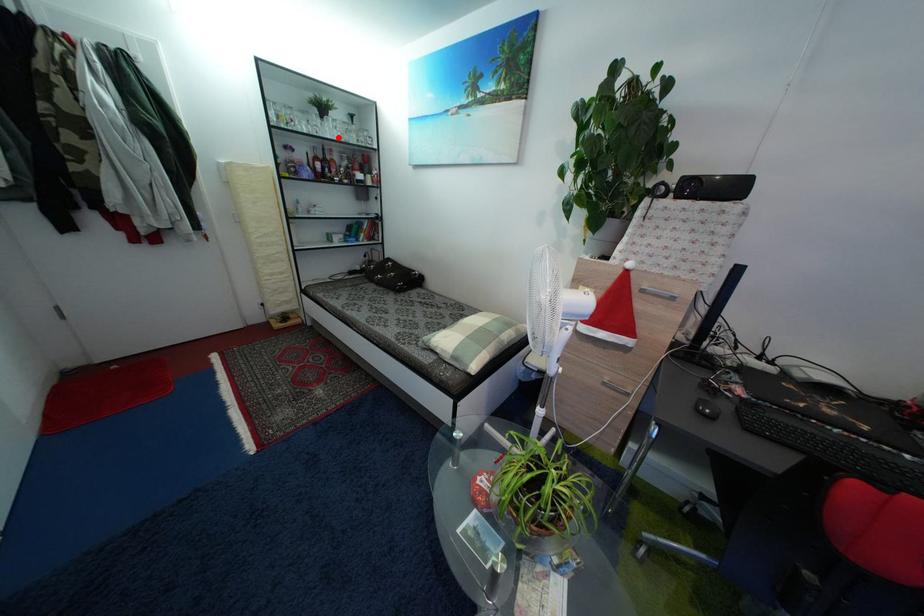
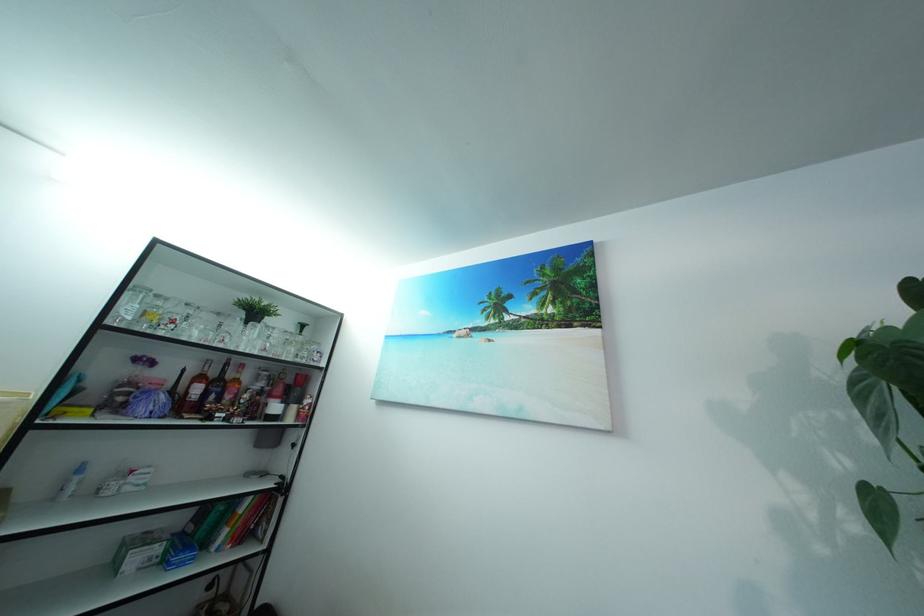
Question: I am providing you with two images of the same scene from different viewpoints. Given a red point in image1, look at the same physical point in image2. Is it:

Choices:
 (A) Closer to the viewpoint
 (B) Farther from the viewpoint

Answer: (B)